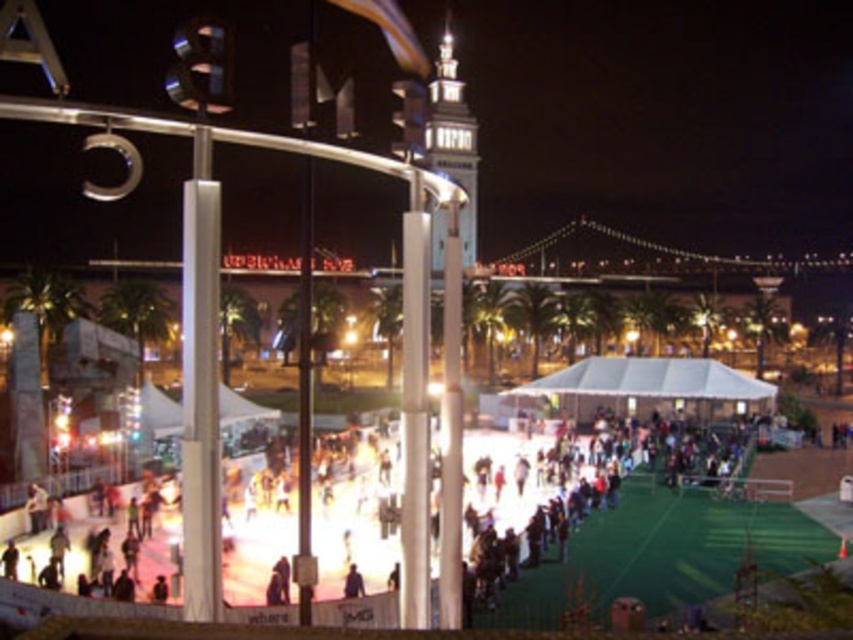
You are standing at the edge of the ice rink and want to move from the dark clothing at center to the white glossy tower at center. Given that you can move at a speed of 3 feet per second, how many seconds will it take you to reach the tower?

The distance between dark clothing at center and white glossy tower at center is 130.36 feet. At a speed of 3 feet per second, it will take approximately 43.45 seconds to reach the tower.

Based on the photo, you are an ice skater standing at the edge of the rink. You see the dark clothing at center and the white glossy tower at center. Which object is closer to the ground?

The dark clothing at center is located below the white glossy tower at center, so it is closer to the ground.